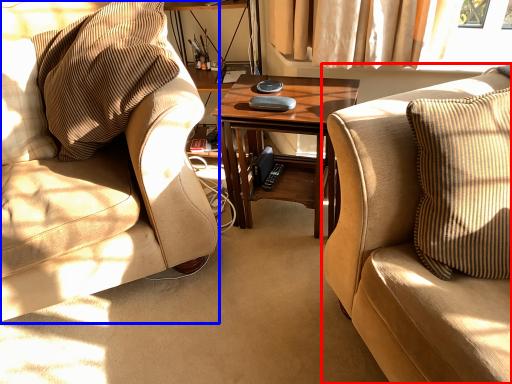
Question: Among these objects, which one is farthest to the camera, studio couch (highlighted by a red box) or chair (highlighted by a blue box)?

Choices:
 (A) studio couch
 (B) chair

Answer: (B)